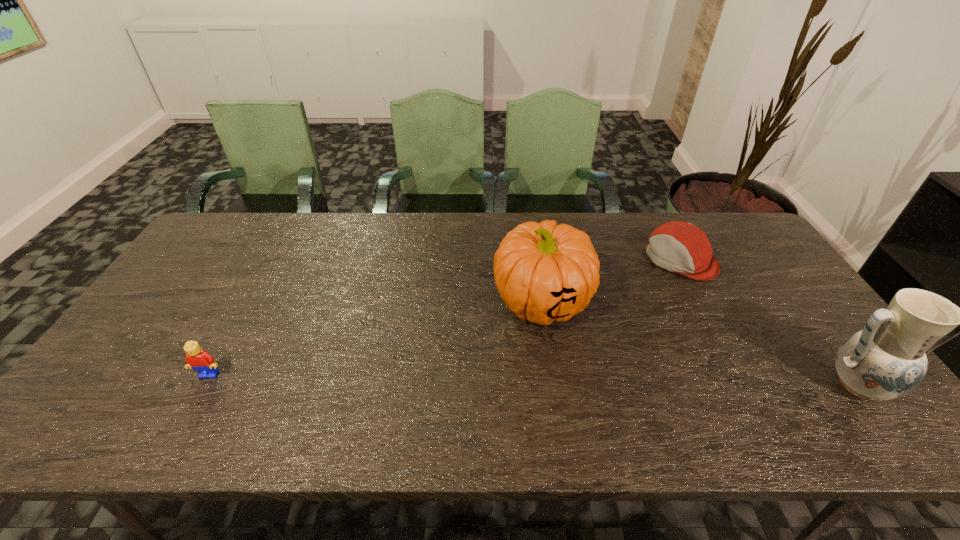
Identify the location of free space between the pumpkin and the cap. (611, 280).

Locate an element on the screen. This screenshot has height=540, width=960. vacant region between the second object from left to right and the third object from left to right is located at coordinates (611, 280).

This screenshot has height=540, width=960. I want to click on the third closest object relative to the Lego, so click(887, 359).

Where is `object that is the third closest one to the second object from left to right`? This screenshot has width=960, height=540. object that is the third closest one to the second object from left to right is located at coordinates (198, 359).